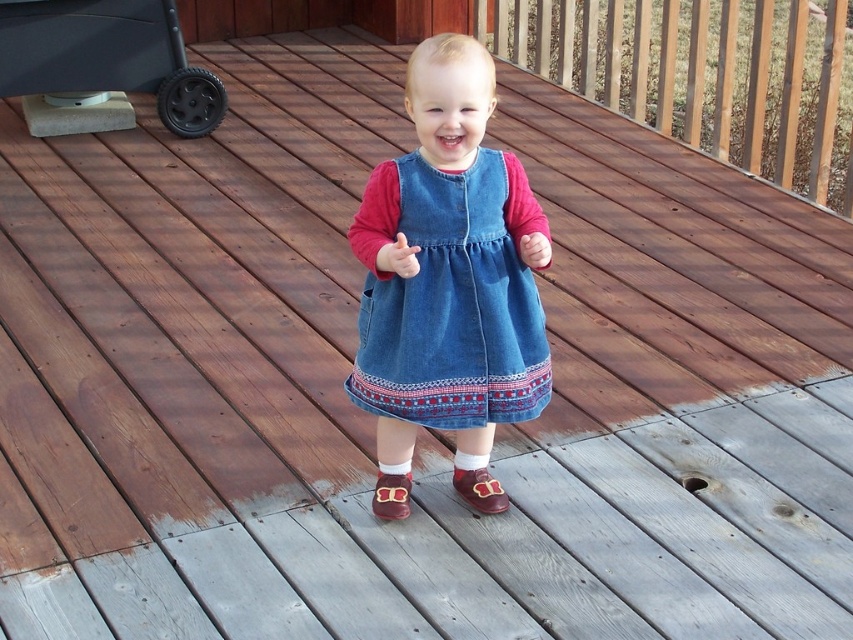
Question: Estimate the real-world distances between objects in this image. Which object is closer to the denim dress at center?

Choices:
 (A) black rubber baby carriage at upper left
 (B) brown suede shoe at center

Answer: (B)

Question: Which of the following is the closest to the observer?

Choices:
 (A) denim dress at center
 (B) brown leather shoe at lower center

Answer: (A)

Question: Which point is closer to the camera?

Choices:
 (A) denim dress at center
 (B) black rubber baby carriage at upper left
 (C) brown leather shoe at lower center

Answer: (A)

Question: Can you confirm if denim dress at center is positioned below black rubber baby carriage at upper left?

Choices:
 (A) yes
 (B) no

Answer: (A)

Question: Does black rubber baby carriage at upper left appear on the left side of brown suede shoe at center?

Choices:
 (A) no
 (B) yes

Answer: (B)

Question: Can you confirm if black rubber baby carriage at upper left is thinner than brown leather shoe at lower center?

Choices:
 (A) no
 (B) yes

Answer: (A)